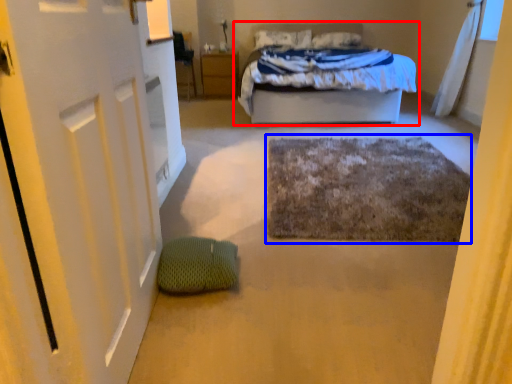
Question: Which point is closer to the camera, bed (highlighted by a red box) or bath mat (highlighted by a blue box)?

Choices:
 (A) bed
 (B) bath mat

Answer: (B)